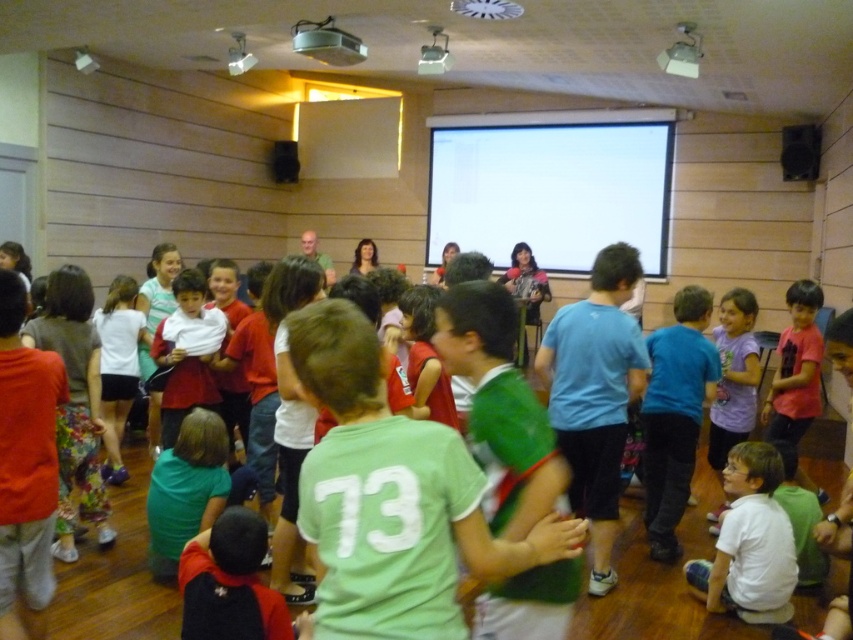
Question: Does green jersey at center come in front of matte green shirt at center?

Choices:
 (A) yes
 (B) no

Answer: (A)

Question: Is white cotton shirt at lower left positioned before matte red shirt at center?

Choices:
 (A) yes
 (B) no

Answer: (B)

Question: Among these points, which one is nearest to the camera?

Choices:
 (A) (334, 44)
 (B) (364, 253)
 (C) (120, 388)

Answer: (C)

Question: Which of the following is the farthest from the observer?

Choices:
 (A) white cotton shirt at lower left
 (B) metallic projector at upper center
 (C) matte green shirt at center

Answer: (C)

Question: Is matte red shirt at center bigger than metallic projector at upper center?

Choices:
 (A) no
 (B) yes

Answer: (B)

Question: Which point is farther to the camera?

Choices:
 (A) blue cotton shirt at center
 (B) green jersey at center
 (C) purple matte shirt at lower right

Answer: (C)